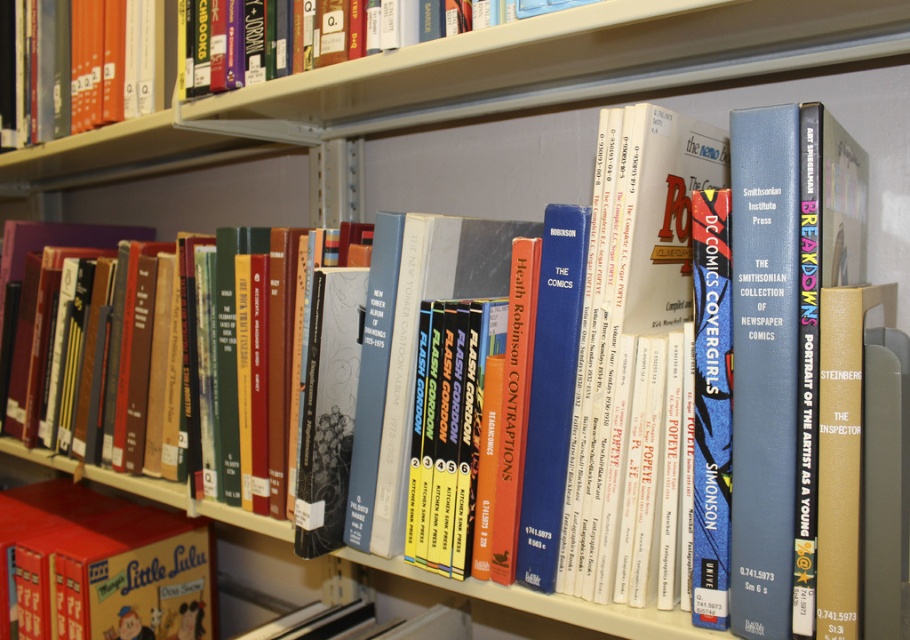
Question: Which point is farther from the camera taking this photo?

Choices:
 (A) (17, 518)
 (B) (108, 10)

Answer: (A)

Question: Can you confirm if matte red book at lower left is thinner than hardcover book at upper left?

Choices:
 (A) no
 (B) yes

Answer: (A)

Question: Among these points, which one is nearest to the camera?

Choices:
 (A) (144, 93)
 (B) (103, 616)

Answer: (A)

Question: In this image, where is matte red book at lower left located relative to hardcover book at upper left?

Choices:
 (A) left
 (B) right

Answer: (A)

Question: Is matte red book at lower left to the right of hardcover book at upper left from the viewer's perspective?

Choices:
 (A) yes
 (B) no

Answer: (B)